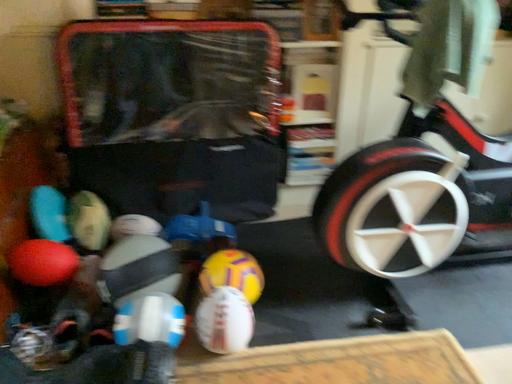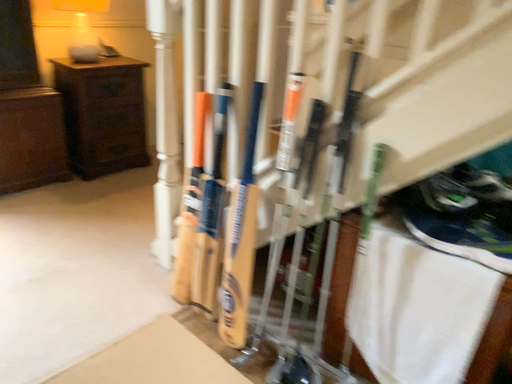
Question: How did the camera likely rotate when shooting the video?

Choices:
 (A) rotated upward
 (B) rotated downward

Answer: (A)